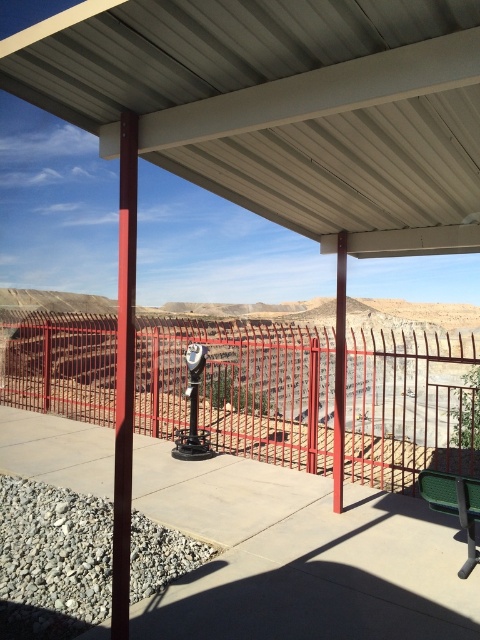
Question: Among these objects, which one is farthest from the camera?

Choices:
 (A) metallic gray canopy at upper center
 (B) green plastic bench at lower right
 (C) red metal fence at center
 (D) smooth red pole at center

Answer: (C)

Question: Which object appears closest to the camera in this image?

Choices:
 (A) metallic gray canopy at upper center
 (B) red metal fence at center

Answer: (A)

Question: In this image, where is metallic gray canopy at upper center located relative to smooth red pole at center?

Choices:
 (A) left
 (B) right

Answer: (B)

Question: Which point appears closest to the camera in this image?

Choices:
 (A) (122, 269)
 (B) (465, 465)
 (C) (421, 472)
 (D) (262, 84)

Answer: (D)

Question: Is red metal fence at center wider than smooth red pole at center?

Choices:
 (A) no
 (B) yes

Answer: (B)

Question: Does metallic gray canopy at upper center appear on the right side of green plastic bench at lower right?

Choices:
 (A) no
 (B) yes

Answer: (A)